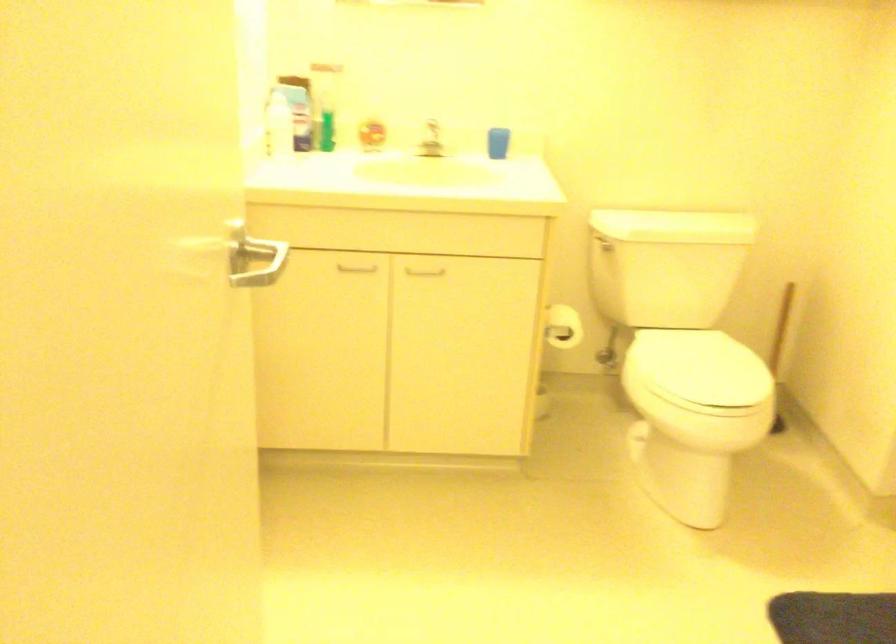
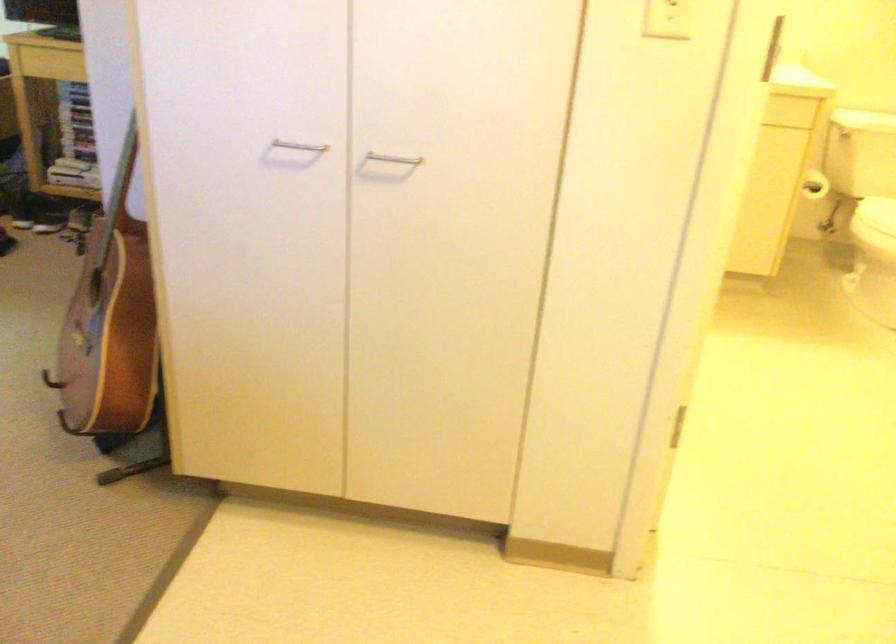
Question: I am providing you with two images of the same scene from different viewpoints. Please identify which objects are invisible in image2.

Choices:
 (A) white toilet lid
 (B) brown acoustic guitar
 (C) white cabinet handle
 (D) blue glass

Answer: (C)